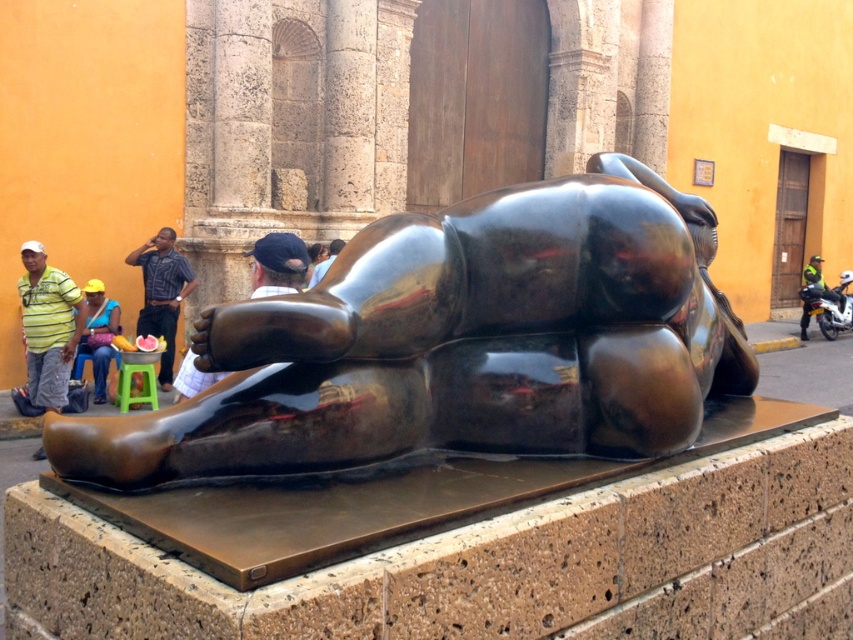
Which of these two, blue plaid shirt at center or shiny black motorcycle at right, stands taller?

blue plaid shirt at center

Locate an element on the screen. This screenshot has height=640, width=853. blue plaid shirt at center is located at coordinates (161, 292).

Is yellow-green striped shirt at left further to camera compared to matte yellow hat at center?

No.

Who is more distant from viewer, (x=57, y=289) or (x=100, y=346)?

Point (x=100, y=346)

Locate an element on the screen. The image size is (853, 640). yellow-green striped shirt at left is located at coordinates (48, 326).

Is the position of matte black cap at center less distant than that of matte black shirt at center?

Yes, it is in front of matte black shirt at center.

Is matte black cap at center shorter than matte black shirt at center?

No, matte black cap at center is not shorter than matte black shirt at center.

Between point (259, 250) and point (331, 262), which one is positioned behind?

Positioned behind is point (331, 262).

This screenshot has height=640, width=853. I want to click on matte black cap at center, so click(x=277, y=264).